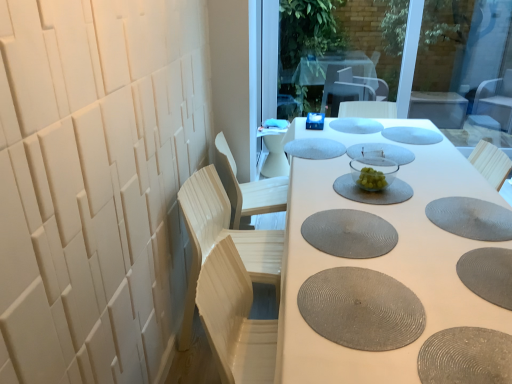
This screenshot has width=512, height=384. I want to click on vacant space in front of clear glass bowl at center, the sixth manhole cover positioned from the front, so click(x=406, y=216).